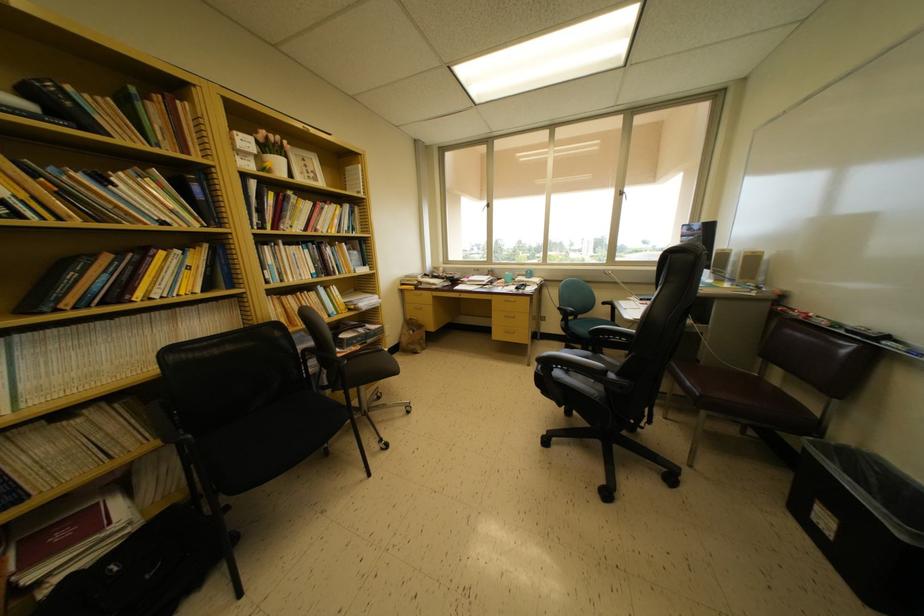
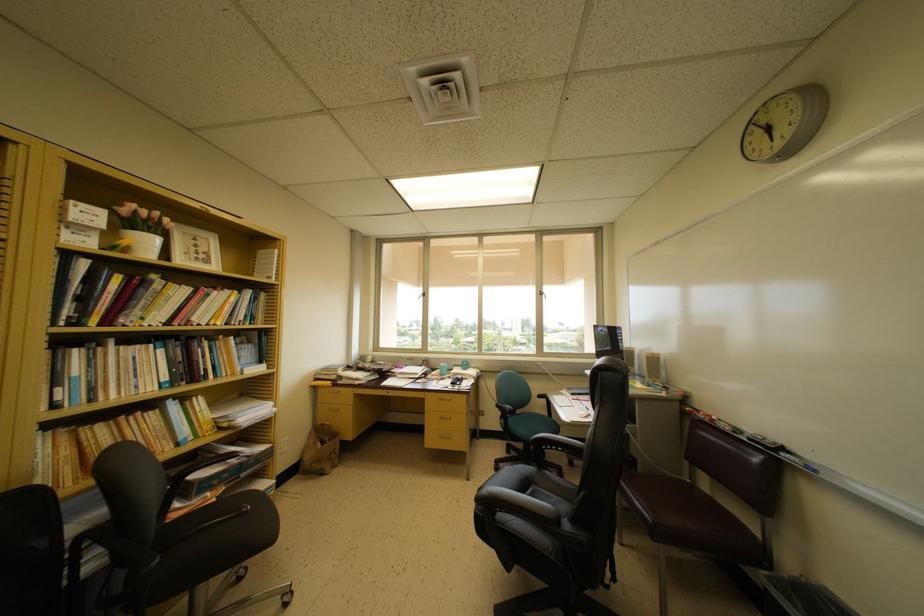
The point at (529,278) is marked in the first image. Where is the corresponding point in the second image?

(465, 369)